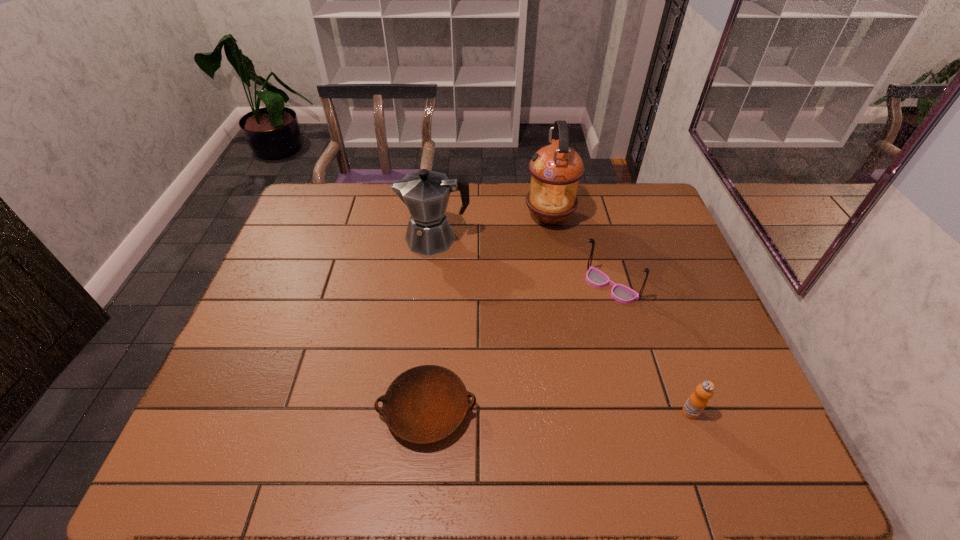
The image size is (960, 540). What are the coordinates of `unoccupied area between the coffeepot and the spectacles` in the screenshot? It's located at (522, 262).

Where is `free space between the tallest object and the second tallest object`? This screenshot has height=540, width=960. free space between the tallest object and the second tallest object is located at coordinates (492, 228).

In order to click on free space between the fourth tallest object and the spectacles in this screenshot , I will do tap(650, 349).

Locate an element on the screen. The width and height of the screenshot is (960, 540). free area in between the second shortest object and the coffeepot is located at coordinates (563, 326).

You are a GUI agent. You are given a task and a screenshot of the screen. Output one action in this format:
    pyautogui.click(x=<x>, y=<y>)
    Task: Click on the vacant space in between the plate and the spectacles
    This screenshot has height=540, width=960.
    Given the screenshot: What is the action you would take?
    pyautogui.click(x=518, y=348)

Choose which object is the fourth nearest neighbor to the oil lamp. Please provide its 2D coordinates. Your answer should be formatted as a tuple, i.e. [(x, y)], where the tuple contains the x and y coordinates of a point satisfying the conditions above.

[(697, 401)]

The height and width of the screenshot is (540, 960). In order to click on object that is the fourth nearest to the rightmost object in this screenshot , I will do `click(426, 193)`.

Where is `vacant space that satisfies the following two spatial constraints: 1. at the spout of the second tallest object; 2. on the right side of the plate`? Image resolution: width=960 pixels, height=540 pixels. vacant space that satisfies the following two spatial constraints: 1. at the spout of the second tallest object; 2. on the right side of the plate is located at coordinates (416, 410).

Locate an element on the screen. vacant space that satisfies the following two spatial constraints: 1. at the spout of the coffeepot; 2. on the left side of the third farthest object is located at coordinates (429, 286).